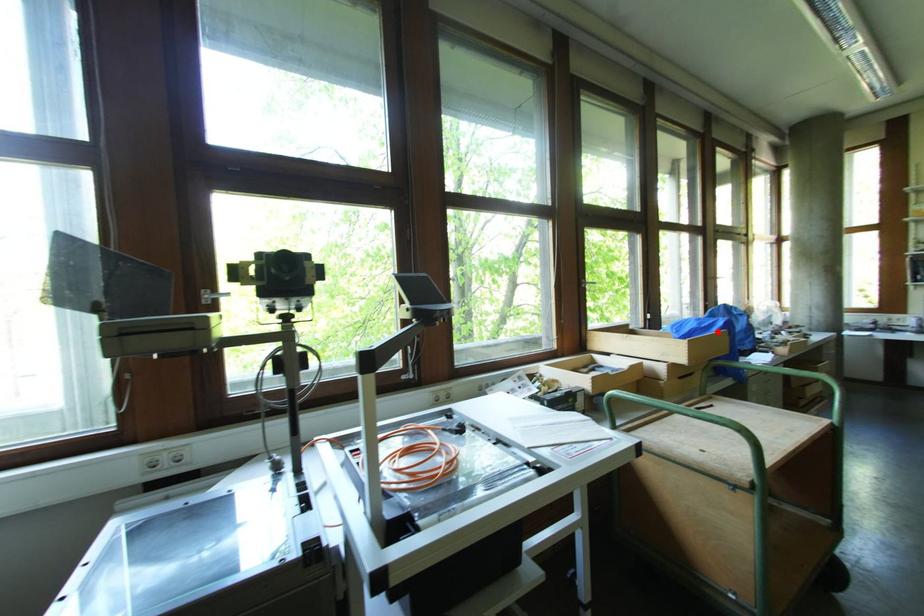
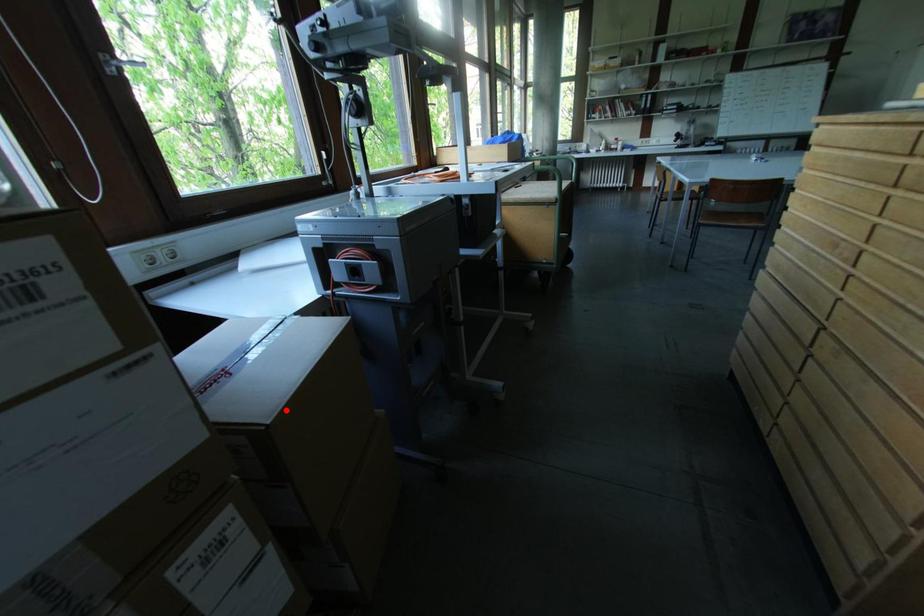
I am providing you with two images of the same scene from different viewpoints. A red point is marked on the first image and another point is marked on the second image. Does the point marked in image1 correspond to the same location as the one in image2?

No